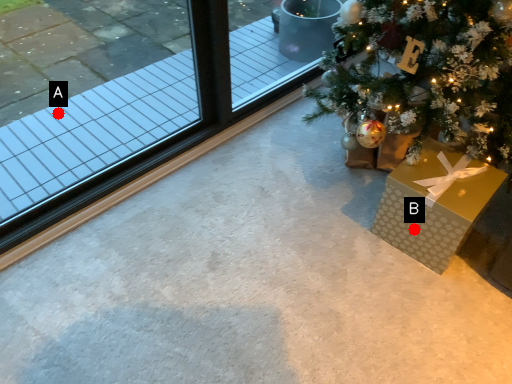
Question: Two points are circled on the image, labeled by A and B beside each circle. Which point is further to the camera?

Choices:
 (A) A is further
 (B) B is further

Answer: (A)